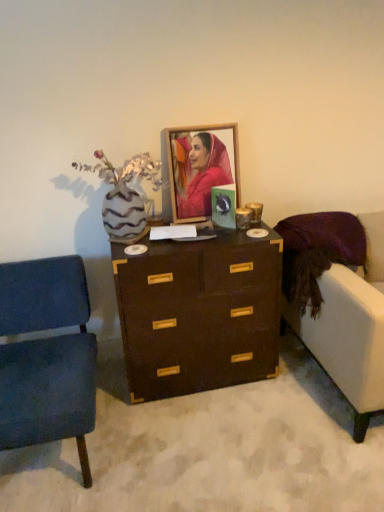
Question: In terms of height, does matte wooden picture frame at center look taller or shorter compared to velvet blue chair at left?

Choices:
 (A) short
 (B) tall

Answer: (A)

Question: Does point (221, 159) appear closer or farther from the camera than point (64, 265)?

Choices:
 (A) closer
 (B) farther

Answer: (B)

Question: Considering the real-world distances, which object is closest to the brown wood chest of drawers at center?

Choices:
 (A) velvet white couch at right
 (B) zebra-patterned vase with dried flowers at left
 (C) matte wooden picture frame at center
 (D) velvet blue chair at left

Answer: (A)

Question: Estimate the real-world distances between objects in this image. Which object is closer to the matte wooden picture frame at center?

Choices:
 (A) brown wood chest of drawers at center
 (B) velvet blue chair at left
 (C) velvet white couch at right
 (D) zebra-patterned vase with dried flowers at left

Answer: (D)